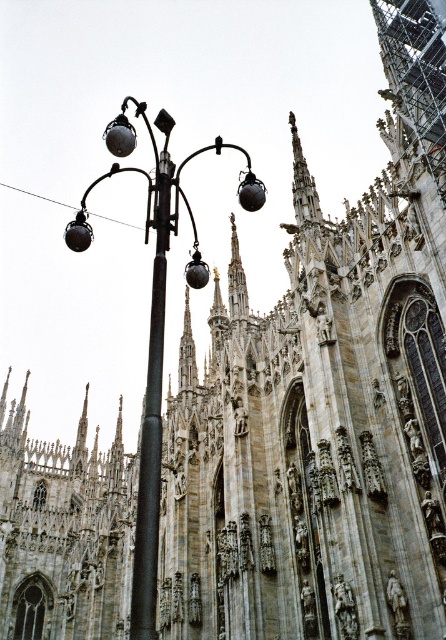
You are standing in front of the cathedral and want to take a photo of the black metal pole at center. To avoid blocking the view, you need to move to the right side of the matte black street light at left. Is this possible given their positions?

The matte black street light at left is positioned on the left side of black metal pole at center. Moving to the right side of the matte black street light at left would place you to the right of the black metal pole at center, which might still block the view. Alternatively, moving behind the matte black street light at left could provide a clearer view of the black metal pole at center.

You are standing in front of the cathedral and want to take a photo of the black metal pole at center without the matte black street light at left blocking it. How should you position yourself?

Move to the right side of the matte black street light at left so that the black metal pole at center comes into view without obstruction from the street light.